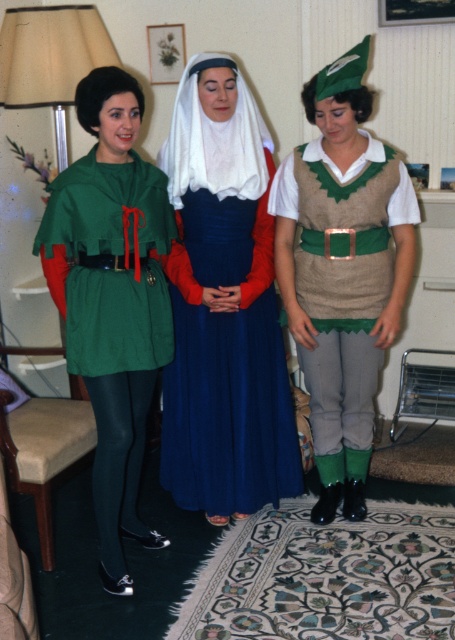
Question: Among these points, which one is nearest to the camera?

Choices:
 (A) (284, 465)
 (B) (92, 301)
 (C) (324, 116)

Answer: (B)

Question: Is blue satin dress at center to the left of green fabric cape at left from the viewer's perspective?

Choices:
 (A) no
 (B) yes

Answer: (A)

Question: Among these objects, which one is nearest to the camera?

Choices:
 (A) green fabric cape at left
 (B) knitted beige vest at center
 (C) blue satin dress at center

Answer: (A)

Question: Which point is farther from the camera taking this photo?

Choices:
 (A) (91, 125)
 (B) (162, 396)

Answer: (B)

Question: Where is blue satin dress at center located in relation to knitted beige vest at center in the image?

Choices:
 (A) above
 (B) below

Answer: (B)

Question: From the image, what is the correct spatial relationship of blue satin dress at center in relation to green fabric cape at left?

Choices:
 (A) right
 (B) left

Answer: (A)